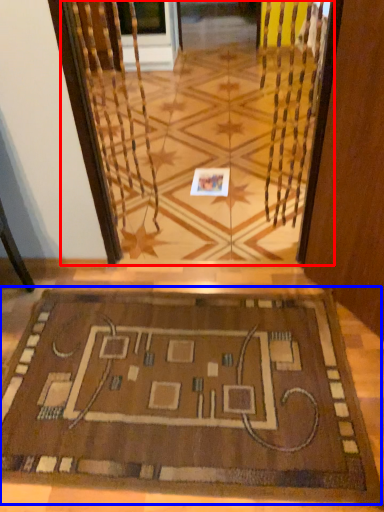
Question: Among these objects, which one is farthest to the camera, glass door (highlighted by a red box) or mat (highlighted by a blue box)?

Choices:
 (A) glass door
 (B) mat

Answer: (A)